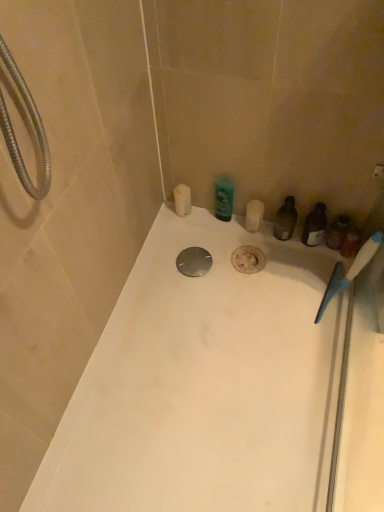
What do you see at coordinates (205, 384) in the screenshot?
I see `white glossy bathtub at center` at bounding box center [205, 384].

The width and height of the screenshot is (384, 512). I want to click on translucent plastic container at right, which is the 1th toiletry from right to left, so click(337, 232).

The width and height of the screenshot is (384, 512). What do you see at coordinates (348, 272) in the screenshot?
I see `blue plastic toothbrush at right` at bounding box center [348, 272].

Where is `green glossy bottle at center, the second toiletry positioned from the right`? green glossy bottle at center, the second toiletry positioned from the right is located at coordinates (224, 198).

What do you see at coordinates (182, 200) in the screenshot? I see `white matte candle at upper left, placed as the 3th toiletry when sorted from right to left` at bounding box center [182, 200].

Where is `white glossy bathtub at center`? This screenshot has width=384, height=512. white glossy bathtub at center is located at coordinates (205, 384).

Does white matte candle at upper left, the first toiletry from the left, appear on the right side of green glossy bottle at center, the second toiletry positioned from the right?

Incorrect, white matte candle at upper left, the first toiletry from the left, is not on the right side of green glossy bottle at center, the second toiletry positioned from the right.

Is white matte candle at upper left, placed as the 3th toiletry when sorted from right to left, far from green glossy bottle at center, the second toiletry positioned from the right?

No, white matte candle at upper left, placed as the 3th toiletry when sorted from right to left, is not far from green glossy bottle at center, the second toiletry positioned from the right.

Between white matte candle at upper left, the first toiletry from the left, and green glossy bottle at center, the second toiletry positioned from the right, which one has larger size?

With larger size is green glossy bottle at center, the second toiletry positioned from the right.

Is blue plastic toothbrush at right further to camera compared to green glossy bottle at center, the second toiletry positioned from the right?

No, blue plastic toothbrush at right is in front of green glossy bottle at center, the second toiletry positioned from the right.

Based on the photo, from the image's perspective, who appears lower, blue plastic toothbrush at right or green glossy bottle at center, the second toiletry positioned from the right?

blue plastic toothbrush at right, from the image's perspective.

Choose the correct answer: Is blue plastic toothbrush at right inside green glossy bottle at center, the second toiletry positioned from the right, or outside it?

blue plastic toothbrush at right is spatially situated outside green glossy bottle at center, the second toiletry positioned from the right.

Between blue plastic toothbrush at right and green glossy bottle at center, the second toiletry positioned from the right, which one has larger width?

blue plastic toothbrush at right is wider.

Is green glossy bottle at center, acting as the second toiletry starting from the left, behind blue plastic toothbrush at right?

Yes, green glossy bottle at center, acting as the second toiletry starting from the left, is further from the viewer.

Could you tell me if green glossy bottle at center, acting as the second toiletry starting from the left, is turned towards blue plastic toothbrush at right?

No, green glossy bottle at center, acting as the second toiletry starting from the left, is not turned towards blue plastic toothbrush at right.

Consider the image. Can we say green glossy bottle at center, the second toiletry positioned from the right, lies outside translucent plastic container at right, the 3th toiletry positioned from the left?

green glossy bottle at center, the second toiletry positioned from the right, lies outside translucent plastic container at right, the 3th toiletry positioned from the left,'s area.

Is there a large distance between green glossy bottle at center, acting as the second toiletry starting from the left, and translucent plastic container at right, which is the 1th toiletry from right to left?

green glossy bottle at center, acting as the second toiletry starting from the left, is near translucent plastic container at right, which is the 1th toiletry from right to left, not far away.

In terms of width, does green glossy bottle at center, the second toiletry positioned from the right, look wider or thinner when compared to translucent plastic container at right, which is the 1th toiletry from right to left?

green glossy bottle at center, the second toiletry positioned from the right, is thinner than translucent plastic container at right, which is the 1th toiletry from right to left.

From the image's perspective, relative to translucent plastic container at right, which is the 1th toiletry from right to left, is green glossy bottle at center, acting as the second toiletry starting from the left, above or below?

Based on their image positions, green glossy bottle at center, acting as the second toiletry starting from the left, is located above translucent plastic container at right, which is the 1th toiletry from right to left.

How different are the orientations of translucent plastic bottle at right and blue plastic toothbrush at right in degrees?

They differ by 12.5 degrees in their facing directions.

From the picture: Can you confirm if translucent plastic bottle at right is shorter than blue plastic toothbrush at right?

Indeed, translucent plastic bottle at right has a lesser height compared to blue plastic toothbrush at right.

Which is in front, translucent plastic bottle at right or blue plastic toothbrush at right?

blue plastic toothbrush at right is more forward.

Who is taller, translucent plastic bottle at right or white matte candle at upper left, placed as the 3th toiletry when sorted from right to left?

translucent plastic bottle at right is taller.

Which object is thinner, translucent plastic bottle at right or white matte candle at upper left, placed as the 3th toiletry when sorted from right to left?

white matte candle at upper left, placed as the 3th toiletry when sorted from right to left, is thinner.

Which is behind, point (294, 218) or point (178, 200)?

The point (178, 200) is behind.

Consider the image. Is translucent plastic bottle at right facing towards white matte candle at upper left, the first toiletry from the left?

No, translucent plastic bottle at right is not aimed at white matte candle at upper left, the first toiletry from the left.

Which object is closer to the camera taking this photo, blue plastic toothbrush at right or white glossy bathtub at center?

white glossy bathtub at center is in front.

In the scene shown: Considering the relative sizes of blue plastic toothbrush at right and white glossy bathtub at center in the image provided, is blue plastic toothbrush at right smaller than white glossy bathtub at center?

Yes, blue plastic toothbrush at right is smaller than white glossy bathtub at center.

Is blue plastic toothbrush at right located outside white glossy bathtub at center?

That's correct, blue plastic toothbrush at right is outside of white glossy bathtub at center.

Which of these two, blue plastic toothbrush at right or white glossy bathtub at center, stands shorter?

white glossy bathtub at center is shorter.

This screenshot has width=384, height=512. What are the coordinates of `the 1st toiletry directly beneath the green glossy bottle at center, the second toiletry positioned from the right (from a real-world perspective)` in the screenshot? It's located at point(182,200).

Locate an element on the screen. toothbrush above the green glossy bottle at center, acting as the second toiletry starting from the left (from a real-world perspective) is located at coordinates (348, 272).

Considering their positions, is green glossy bottle at center, acting as the second toiletry starting from the left, positioned closer to translucent plastic container at right, which is the 1th toiletry from right to left, than white matte candle at upper left, placed as the 3th toiletry when sorted from right to left?

green glossy bottle at center, acting as the second toiletry starting from the left.

Looking at the image, which one is located closer to translucent plastic bottle at right, green glossy bottle at center, acting as the second toiletry starting from the left, or blue plastic toothbrush at right?

green glossy bottle at center, acting as the second toiletry starting from the left, lies closer to translucent plastic bottle at right than the other object.

From the image, which object appears to be nearer to blue plastic toothbrush at right, white matte candle at upper left, placed as the 3th toiletry when sorted from right to left, or translucent plastic container at right, which is the 1th toiletry from right to left?

The object closer to blue plastic toothbrush at right is translucent plastic container at right, which is the 1th toiletry from right to left.

Looking at the image, which one is located closer to translucent plastic bottle at right, white glossy bathtub at center or blue plastic toothbrush at right?

Based on the image, blue plastic toothbrush at right appears to be nearer to translucent plastic bottle at right.

Estimate the real-world distances between objects in this image. Which object is further from white glossy bathtub at center, translucent plastic bottle at right or green glossy bottle at center, acting as the second toiletry starting from the left?

The object further to white glossy bathtub at center is green glossy bottle at center, acting as the second toiletry starting from the left.

Estimate the real-world distances between objects in this image. Which object is further from green glossy bottle at center, the second toiletry positioned from the right, white glossy bathtub at center or white matte candle at upper left, the first toiletry from the left?

The object further to green glossy bottle at center, the second toiletry positioned from the right, is white glossy bathtub at center.

Looking at the image, which one is located closer to translucent plastic container at right, the 3th toiletry positioned from the left, white matte candle at upper left, the first toiletry from the left, or blue plastic toothbrush at right?

blue plastic toothbrush at right lies closer to translucent plastic container at right, the 3th toiletry positioned from the left, than the other object.

Considering their positions, is white glossy bathtub at center positioned closer to blue plastic toothbrush at right than white matte candle at upper left, placed as the 3th toiletry when sorted from right to left?

Among the two, white glossy bathtub at center is located nearer to blue plastic toothbrush at right.

At what (x,y) coordinates should I click in order to perform the action: click on bottle between blue plastic toothbrush at right and translucent plastic container at right, which is the 1th toiletry from right to left, in the front-back direction. Please return your answer as a coordinate pair (x, y). Looking at the image, I should click on (285, 220).

Where is `toothbrush between white matte candle at upper left, the first toiletry from the left, and translucent plastic container at right, which is the 1th toiletry from right to left, in the horizontal direction`? Image resolution: width=384 pixels, height=512 pixels. toothbrush between white matte candle at upper left, the first toiletry from the left, and translucent plastic container at right, which is the 1th toiletry from right to left, in the horizontal direction is located at coordinates (348, 272).

This screenshot has width=384, height=512. What are the coordinates of `toothbrush between white glossy bathtub at center and translucent plastic container at right, which is the 1th toiletry from right to left, along the z-axis` in the screenshot? It's located at (348, 272).

This screenshot has width=384, height=512. In order to click on bottle between white matte candle at upper left, placed as the 3th toiletry when sorted from right to left, and translucent plastic container at right, which is the 1th toiletry from right to left, from left to right in this screenshot , I will do `click(285, 220)`.